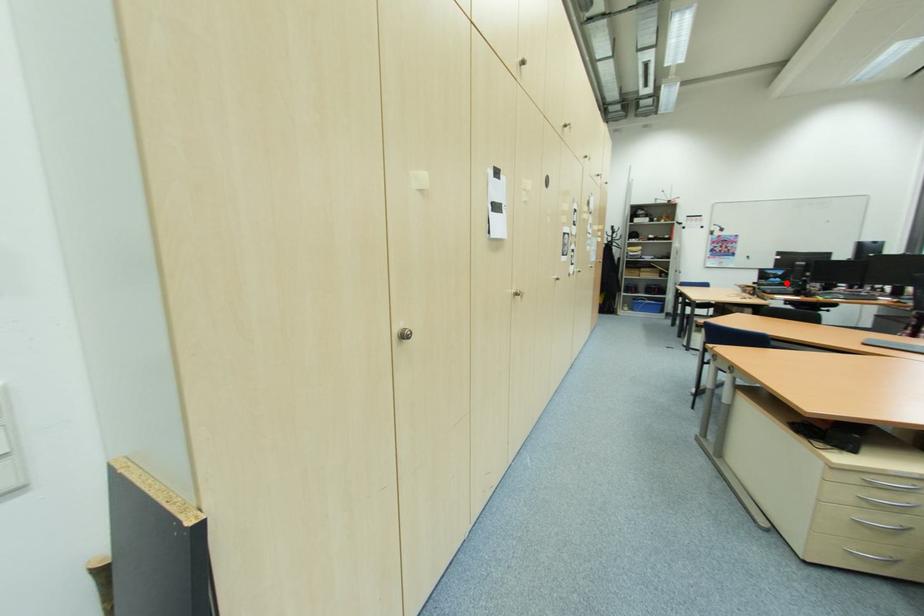
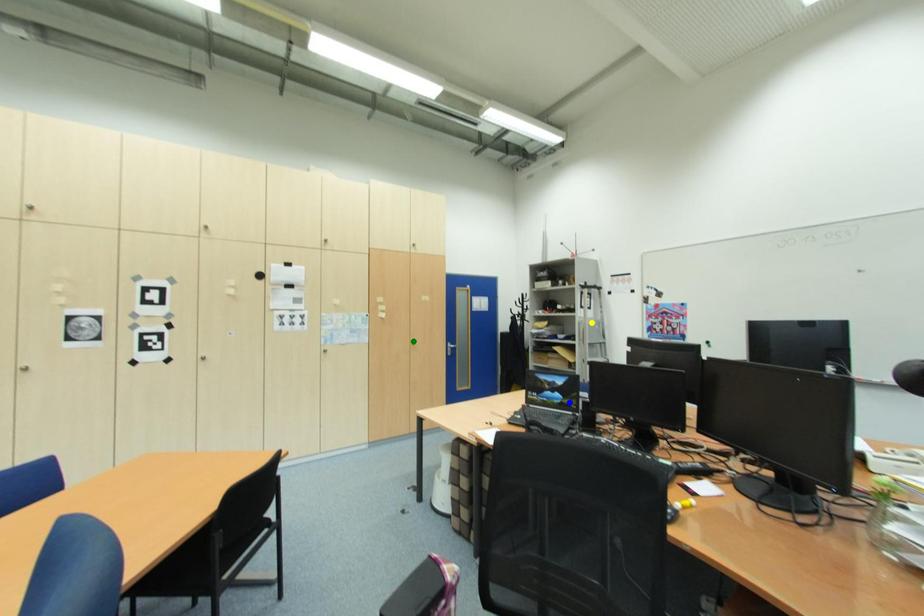
Question: I am providing you with two images of the same scene from different viewpoints. A red point is marked on the first image. You are given multiple points on the second image. In image 2, which mark is for the same physical point as the one in image 1?

Choices:
 (A) blue point
 (B) yellow point
 (C) green point

Answer: (A)